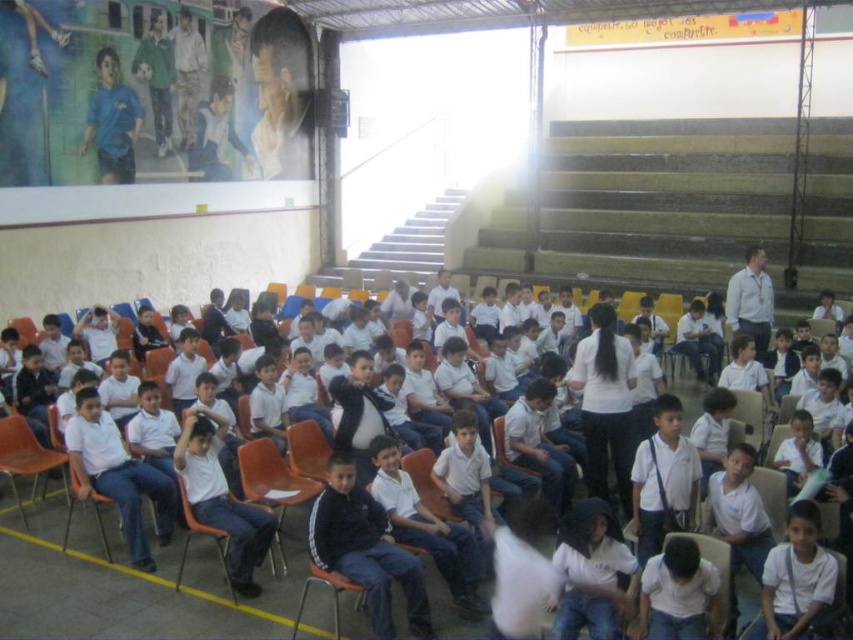
You are standing at the entrance of the assembly hall and notice a white cotton shirt at center. If you want to walk directly towards it, which direction should you move relative to the large window on the right side of the hall?

Since the white cotton shirt at center is located at point (128, 582), you should move towards the left direction relative to the large window on the right side of the hall to reach it.

You are standing in the assembly hall and want to take a photo of the white matte shirt at lower right. The camera you have can focus on objects up to 5 meters away. Can you take the photo without moving closer?

The white matte shirt at lower right and camera are 4.31 meters apart from each other. Since the camera can focus up to 5 meters, you can take the photo without moving closer.